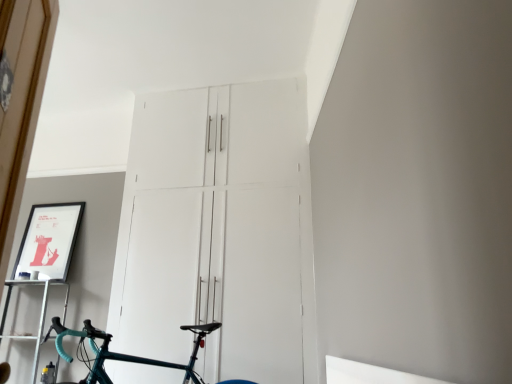
Question: From a real-world perspective, relative to matte black picture frame at upper left, is metallic silver shelf at lower left vertically above or below?

Choices:
 (A) below
 (B) above

Answer: (A)

Question: Do you think metallic silver shelf at lower left is within matte black picture frame at upper left, or outside of it?

Choices:
 (A) inside
 (B) outside

Answer: (B)

Question: Estimate the real-world distances between objects in this image. Which object is farther from the metallic silver shelf at lower left?

Choices:
 (A) matte black picture frame at upper left
 (B) white matte cabinet at center
 (C) teal glossy bicycle at center

Answer: (B)

Question: Which is farther from the teal glossy bicycle at center?

Choices:
 (A) white matte cabinet at center
 (B) metallic silver shelf at lower left
 (C) matte black picture frame at upper left

Answer: (C)